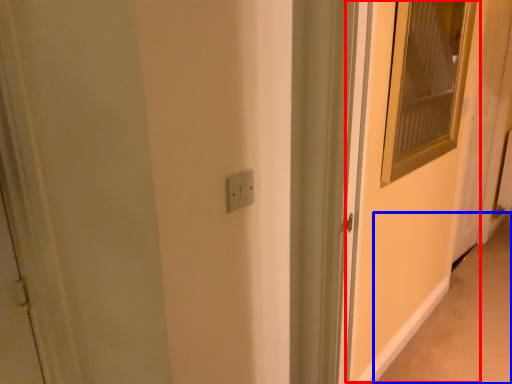
Question: Which point is further to the camera, screen door (highlighted by a red box) or alley (highlighted by a blue box)?

Choices:
 (A) screen door
 (B) alley

Answer: (B)